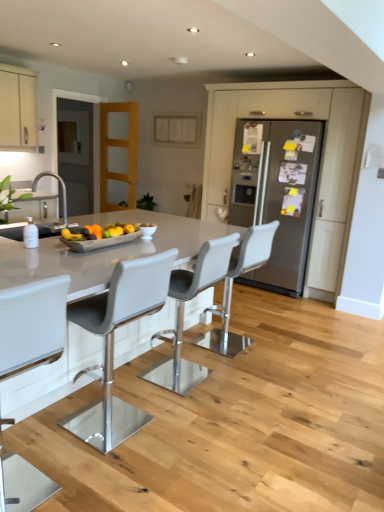
Find the location of a particular element. vacant space to the right of white leather bar stool at center, the second chair in the back-to-front sequence is located at coordinates [x=241, y=384].